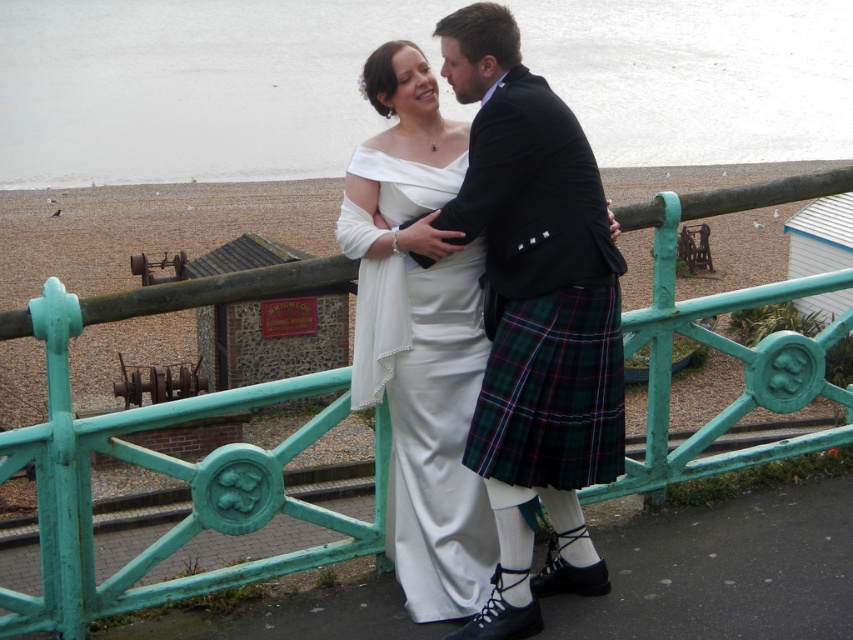
Can you confirm if matte white dress at center is shorter than white satin dress at center?

No.

Where is `matte white dress at center`? matte white dress at center is located at coordinates (491, 355).

Is point (428, 292) positioned behind point (454, 163)?

No, it is not.

Where is `matte white dress at center`? This screenshot has width=853, height=640. matte white dress at center is located at coordinates (491, 355).

The image size is (853, 640). What do you see at coordinates (491, 355) in the screenshot?
I see `matte white dress at center` at bounding box center [491, 355].

Is point (543, 232) less distant than point (590, 444)?

Yes, it is in front of point (590, 444).

Find the location of a particular element. Image resolution: width=853 pixels, height=640 pixels. matte white dress at center is located at coordinates click(x=491, y=355).

Can you confirm if white satin dress at center is smaller than green plaid kilt at center?

Incorrect, white satin dress at center is not smaller in size than green plaid kilt at center.

Who is positioned more to the right, white satin dress at center or green plaid kilt at center?

green plaid kilt at center is more to the right.

Measure the distance between white satin dress at center and camera.

12.83 feet

Image resolution: width=853 pixels, height=640 pixels. In order to click on white satin dress at center in this screenshot , I will do `click(425, 413)`.